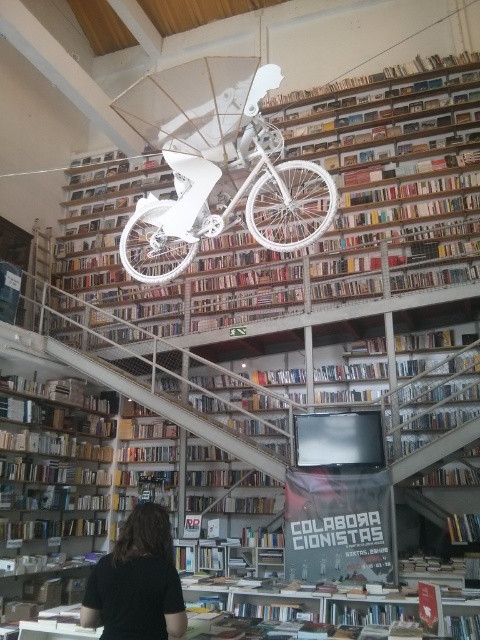
Is white matte bicycle at center positioned behind wooden bookshelf at lower left?

No, white matte bicycle at center is in front of wooden bookshelf at lower left.

This screenshot has width=480, height=640. Describe the element at coordinates (217, 168) in the screenshot. I see `white matte bicycle at center` at that location.

Find the location of a particular element. This screenshot has width=480, height=640. white matte bicycle at center is located at coordinates (217, 168).

Is point (54, 445) positioned before point (126, 596)?

No, (54, 445) is behind (126, 596).

Can you confirm if wooden bookshelf at lower left is bigger than black shirt at lower center?

Indeed, wooden bookshelf at lower left has a larger size compared to black shirt at lower center.

Find the location of a particular element. The width and height of the screenshot is (480, 640). wooden bookshelf at lower left is located at coordinates (50, 490).

Can you confirm if white matte bookcase at center is positioned below wooden bookshelf at lower left?

No.

Between point (200, 227) and point (91, 496), which one is positioned in front?

Point (200, 227) is more forward.

Is point (432, 65) farther from camera compared to point (3, 616)?

That is True.

Identify the location of white matte bookcase at center. This screenshot has height=640, width=480. (291, 205).